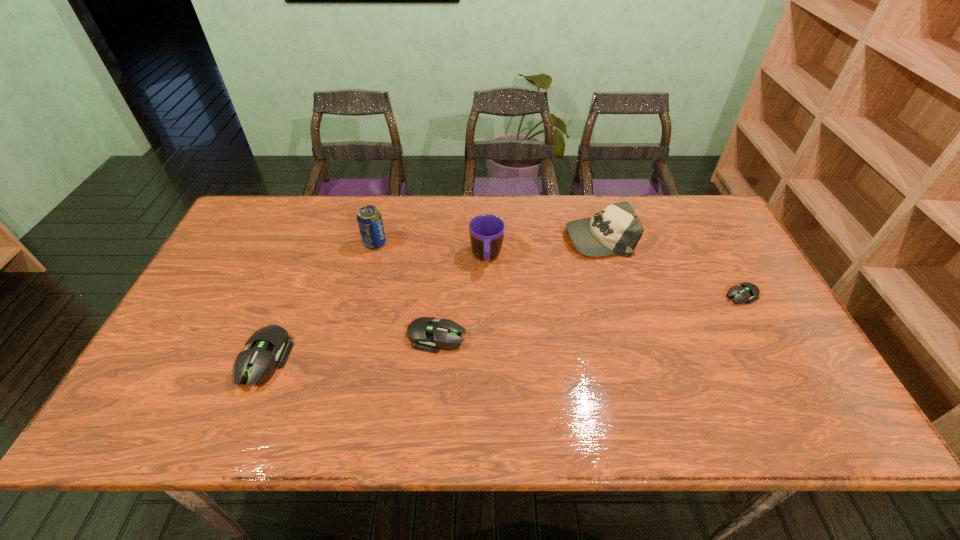
Choose which computer mouse is the nearest neighbor to the fourth farthest object. Please provide its 2D coordinates. Your answer should be formatted as a tuple, i.e. [(x, y)], where the tuple contains the x and y coordinates of a point satisfying the conditions above.

[(425, 334)]

Locate an element on the screen. The width and height of the screenshot is (960, 540). vacant region that satisfies the following two spatial constraints: 1. on the front-facing side of the baseball cap; 2. with the handle on the side of the mug is located at coordinates (605, 258).

Where is `free spot that satisfies the following two spatial constraints: 1. on the front-facing side of the baseball cap; 2. on the front side of the fifth tallest object`? The image size is (960, 540). free spot that satisfies the following two spatial constraints: 1. on the front-facing side of the baseball cap; 2. on the front side of the fifth tallest object is located at coordinates (627, 336).

Identify the location of free location that satisfies the following two spatial constraints: 1. on the front-facing side of the second object from right to left; 2. with the handle on the side of the third object from right to left. (605, 258).

Find the location of `free location that satisfies the following two spatial constraints: 1. on the front-facing side of the baseball cap; 2. with the handle on the side of the mug`. free location that satisfies the following two spatial constraints: 1. on the front-facing side of the baseball cap; 2. with the handle on the side of the mug is located at coordinates (605, 258).

Find the location of `free point that satisfies the following two spatial constraints: 1. on the front-facing side of the fourth shortest object; 2. on the back side of the rightmost computer mouse`. free point that satisfies the following two spatial constraints: 1. on the front-facing side of the fourth shortest object; 2. on the back side of the rightmost computer mouse is located at coordinates (615, 294).